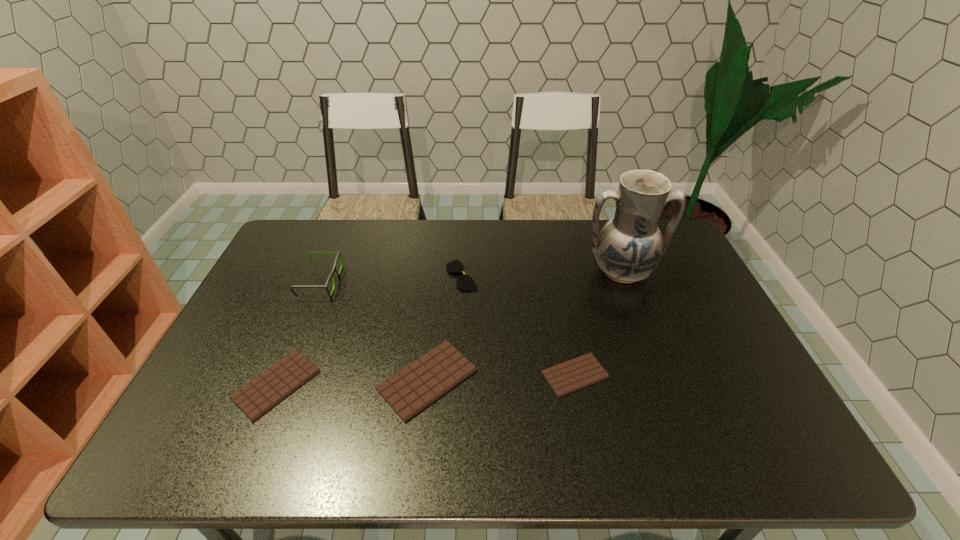
Locate an element on the screen. This screenshot has height=540, width=960. the second tallest chocolate bar is located at coordinates (258, 396).

In order to click on the second chocolate bar from right to left in this screenshot , I will do `click(410, 390)`.

This screenshot has height=540, width=960. In order to click on the shortest chocolate bar in this screenshot , I will do click(x=572, y=375).

Locate an element on the screen. The width and height of the screenshot is (960, 540). the shortest object is located at coordinates (572, 375).

Where is `the tallest object`? The image size is (960, 540). the tallest object is located at coordinates (629, 248).

Where is `pitcher`? This screenshot has width=960, height=540. pitcher is located at coordinates (629, 248).

What are the coordinates of `the right spectacles` in the screenshot? It's located at (465, 282).

This screenshot has width=960, height=540. Identify the location of the fifth shortest object. click(339, 254).

Locate an element on the screen. The width and height of the screenshot is (960, 540). the taller spectacles is located at coordinates (339, 254).

What are the coordinates of `vacant area located on the right of the leftmost chocolate bar` in the screenshot? It's located at (468, 384).